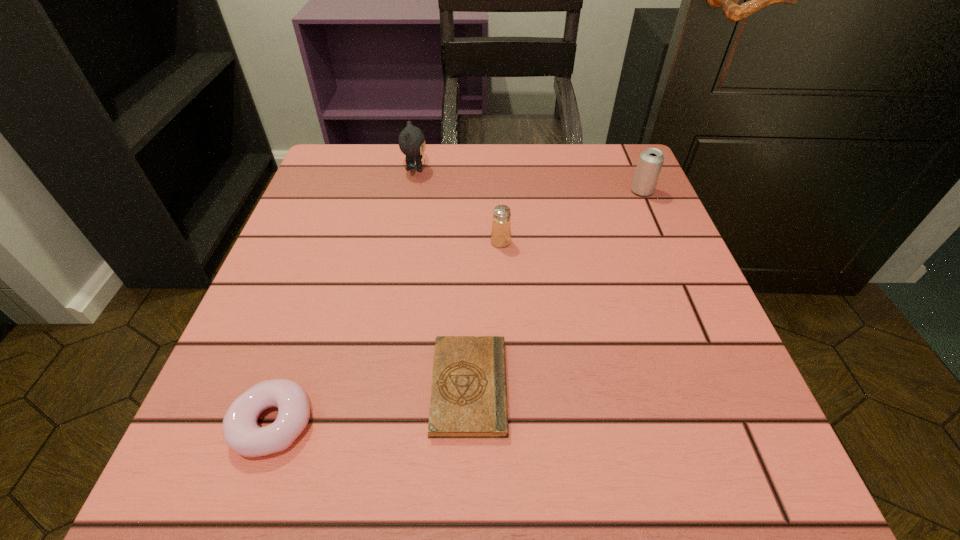
The image size is (960, 540). Find the location of `object that is at the near left corner`. object that is at the near left corner is located at coordinates (241, 432).

This screenshot has height=540, width=960. In order to click on object present at the far right corner in this screenshot , I will do `click(650, 162)`.

Image resolution: width=960 pixels, height=540 pixels. In the image, there is a desktop. Find the location of `vacant space at the far edge`. vacant space at the far edge is located at coordinates [557, 152].

The image size is (960, 540). In order to click on blank space at the near edge of the desktop in this screenshot , I will do `click(315, 480)`.

Identify the location of free region at the left edge of the desktop. (333, 349).

Locate an element on the screen. This screenshot has height=540, width=960. vacant space at the right edge of the desktop is located at coordinates (675, 261).

The width and height of the screenshot is (960, 540). Identify the location of vacant space at the far left corner of the desktop. (350, 200).

Find the location of a particular element. vacant space at the near left corner of the desktop is located at coordinates (201, 438).

Where is `free space at the far right corner`? Image resolution: width=960 pixels, height=540 pixels. free space at the far right corner is located at coordinates (610, 159).

This screenshot has height=540, width=960. Find the location of `vacant area at the near right corner`. vacant area at the near right corner is located at coordinates (658, 466).